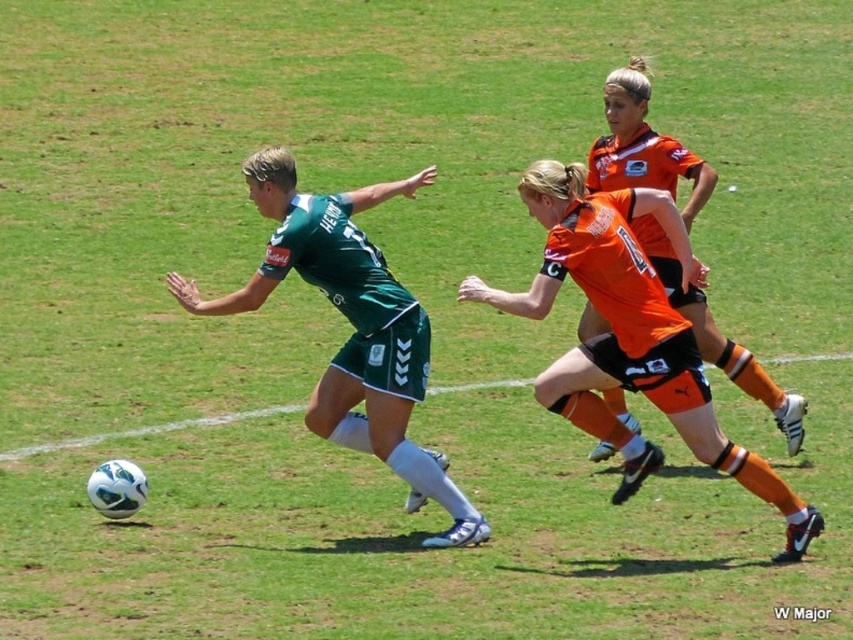
Who is shorter, green matte jersey at center or orange matte jersey at center?

With less height is orange matte jersey at center.

The image size is (853, 640). What do you see at coordinates (352, 324) in the screenshot?
I see `green matte jersey at center` at bounding box center [352, 324].

The width and height of the screenshot is (853, 640). What do you see at coordinates (352, 324) in the screenshot? I see `green matte jersey at center` at bounding box center [352, 324].

Locate an element on the screen. green matte jersey at center is located at coordinates (352, 324).